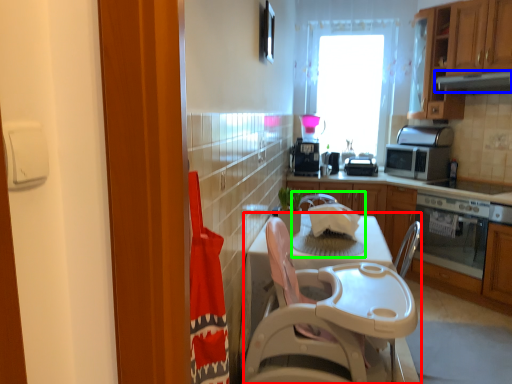
Question: Which object is the closest to the table (highlighted by a red box)? Choose among these: exhaust hood (highlighted by a blue box) or sink (highlighted by a green box).

Choices:
 (A) exhaust hood
 (B) sink

Answer: (B)